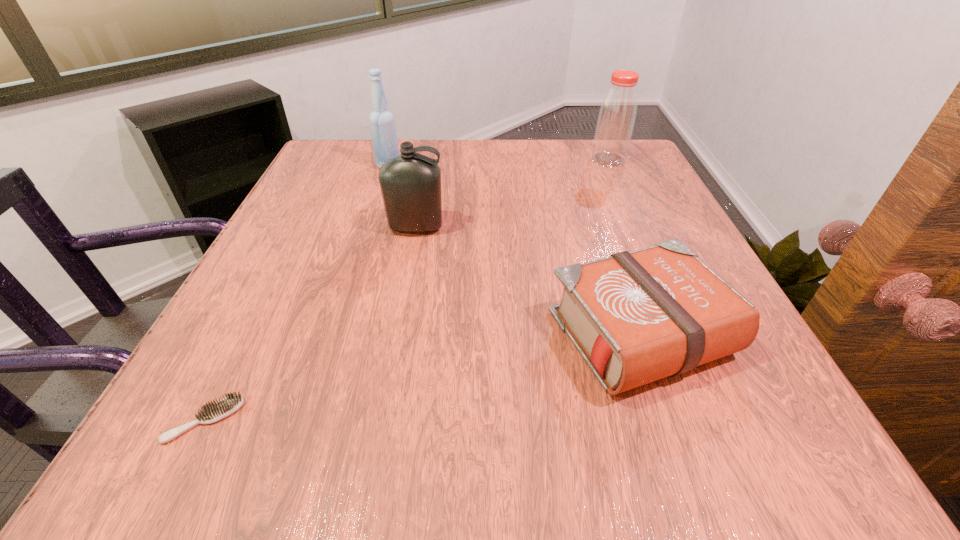
I want to click on vacant area situated 0.250m on the back of the Bible, so click(594, 202).

Find the location of a particular element. The height and width of the screenshot is (540, 960). vacant space located 0.120m on the right of the leftmost object is located at coordinates (329, 420).

Where is `Bible at the near edge`? Bible at the near edge is located at coordinates (635, 317).

You are a GUI agent. You are given a task and a screenshot of the screen. Output one action in this format:
    pyautogui.click(x=<x>, y=<y>)
    Task: Click on the scrubbing brush at the near edge
    The height and width of the screenshot is (540, 960).
    Given the screenshot: What is the action you would take?
    pyautogui.click(x=214, y=411)

Where is `bottle at the left edge`? The width and height of the screenshot is (960, 540). bottle at the left edge is located at coordinates (382, 123).

This screenshot has width=960, height=540. Find the location of `scrubbing brush that is at the left edge`. scrubbing brush that is at the left edge is located at coordinates (214, 411).

Find the location of a particular element. The height and width of the screenshot is (540, 960). bottle positioned at the right edge is located at coordinates (617, 114).

In order to click on Bible located at the right edge in this screenshot , I will do `click(635, 317)`.

Locate an element on the screen. object present at the far left corner is located at coordinates (382, 123).

I want to click on object at the near left corner, so click(x=214, y=411).